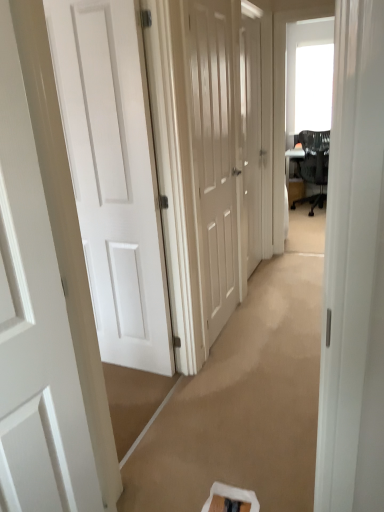
Question: Considering the positions of white matte door at left, which is the third door in back-to-front order, and white glossy door at center, which is the 4th door in front-to-back order, in the image, is white matte door at left, which is the third door in back-to-front order, wider or thinner than white glossy door at center, which is the 4th door in front-to-back order,?

Choices:
 (A) wide
 (B) thin

Answer: (A)

Question: From the image's perspective, relative to white glossy door at center, which appears as the 1th door when viewed from the back, is white matte door at left, acting as the 2th door starting from the front, above or below?

Choices:
 (A) below
 (B) above

Answer: (A)

Question: Estimate the real-world distances between objects in this image. Which object is farther from the white matte door at left, acting as the 2th door starting from the front?

Choices:
 (A) matte white door at center, the third door viewed from the front
 (B) white glossy door at center, which appears as the 1th door when viewed from the back
 (C) white glossy door at left, the first door viewed from the front
 (D) black mesh chair at upper right

Answer: (D)

Question: Considering the real-world distances, which object is closest to the matte white door at center, which is the 2th door in back-to-front order?

Choices:
 (A) white matte door at left, acting as the 2th door starting from the front
 (B) white glossy door at left, which is the fourth door in back-to-front order
 (C) white glossy door at center, which appears as the 1th door when viewed from the back
 (D) black mesh chair at upper right

Answer: (A)